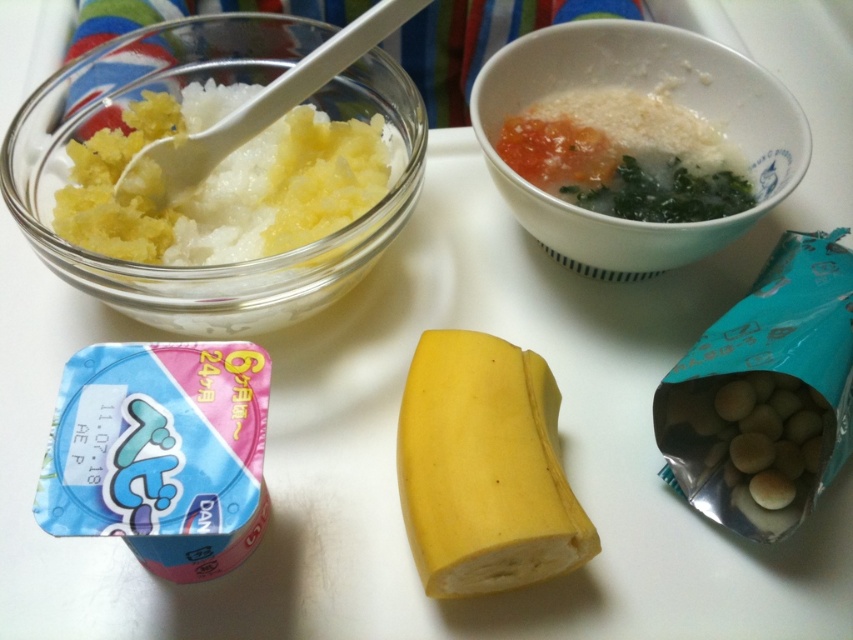
Does white matte bowl at upper right appear on the left side of white creamy soup at upper right?

Correct, you'll find white matte bowl at upper right to the left of white creamy soup at upper right.

Which is in front, point (547, 205) or point (614, 102)?

Point (547, 205) is in front.

The height and width of the screenshot is (640, 853). I want to click on white matte bowl at upper right, so click(645, 88).

Is point (432, 563) positioned behind point (814, 422)?

No.

What do you see at coordinates (485, 468) in the screenshot? This screenshot has width=853, height=640. I see `yellow matte/skinny banana at center` at bounding box center [485, 468].

Who is more forward, (x=426, y=348) or (x=666, y=456)?

Positioned in front is point (x=426, y=348).

You are a GUI agent. You are given a task and a screenshot of the screen. Output one action in this format:
    pyautogui.click(x=<x>, y=<y>)
    Task: Click on the yellow matte/skinny banana at center
    Image resolution: width=853 pixels, height=640 pixels.
    Given the screenshot: What is the action you would take?
    pyautogui.click(x=485, y=468)

Which of these two, white matte bowl at upper right or white plastic spoon at upper left, stands shorter?

white plastic spoon at upper left is shorter.

Is point (573, 74) closer to camera compared to point (323, 77)?

No.

The height and width of the screenshot is (640, 853). Identify the location of white matte bowl at upper right. (645, 88).